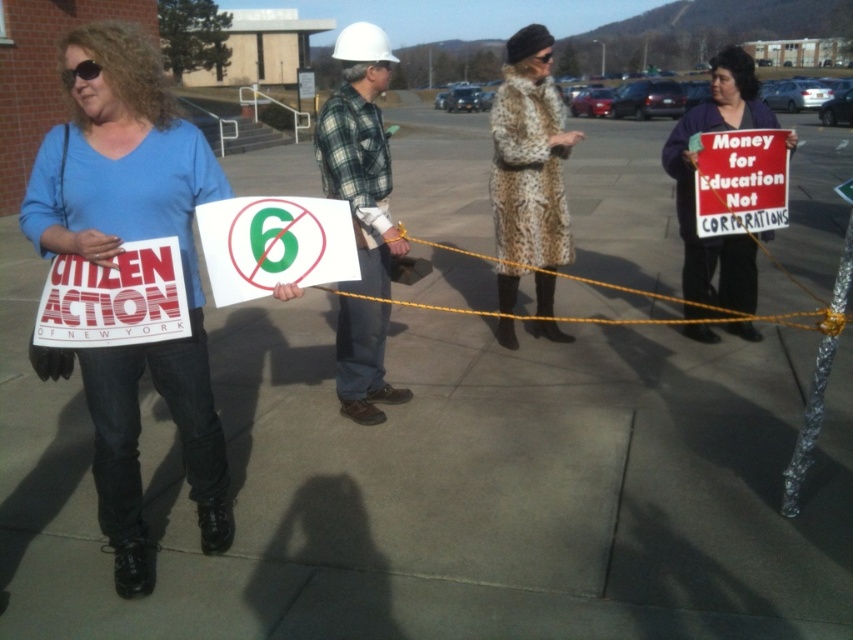
You are a photographer trying to capture both the white paper sign at left and the white paper sign at center in a single frame. Based on their positions, which sign should you focus on first to ensure both are in the shot?

Since the white paper sign at center is to the right of the white paper sign at left, you should focus on the white paper sign at left first to frame both signs properly.

Where is the plaid flannel shirt at center located in the image?

The plaid flannel shirt at center is located at point [360,154].